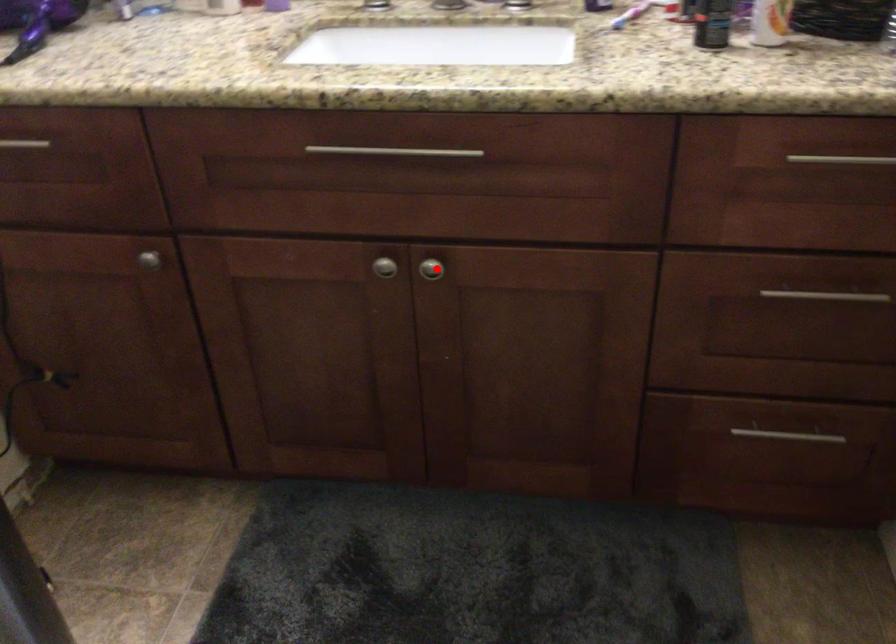
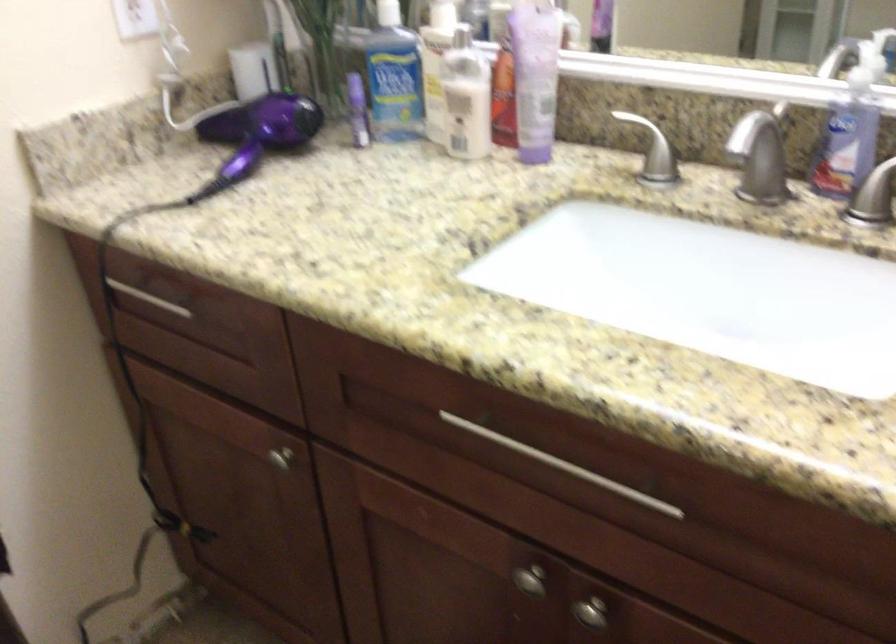
Find the pixel in the second image that matches the highlighted location in the first image.

(590, 612)